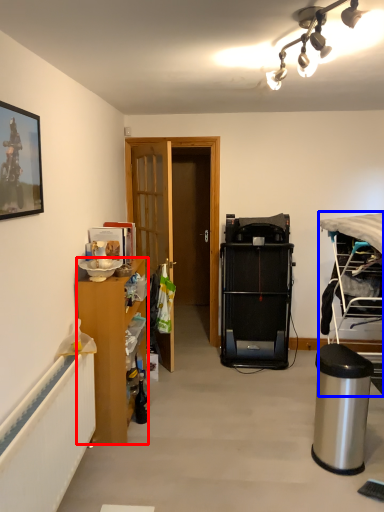
Question: Which object appears farthest to the camera in this image, cabinetry (highlighted by a red box) or desk (highlighted by a blue box)?

Choices:
 (A) cabinetry
 (B) desk

Answer: (A)